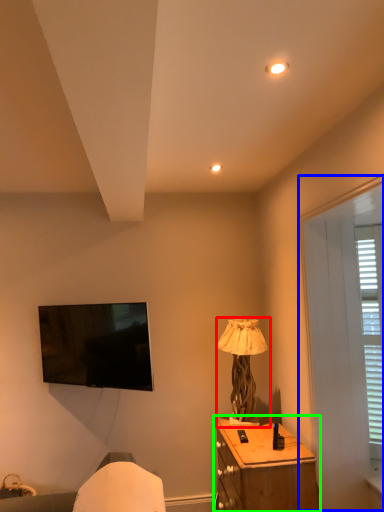
Question: Which is nearer to the lamp (highlighted by a red box)? screen door (highlighted by a blue box) or nightstand (highlighted by a green box).

Choices:
 (A) screen door
 (B) nightstand

Answer: (B)